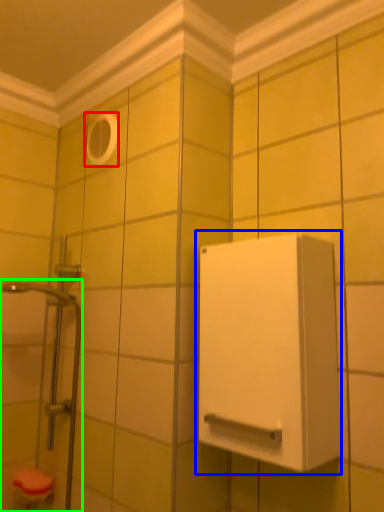
Question: Which is farther away from hole (highlighted by a red box)? medicine cabinet (highlighted by a blue box) or shower door (highlighted by a green box)?

Choices:
 (A) medicine cabinet
 (B) shower door

Answer: (A)